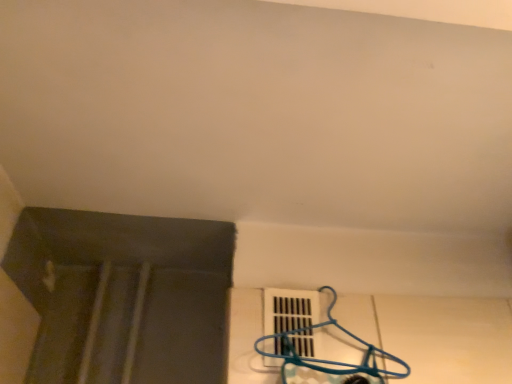
Question: Considering the relative positions of white plastic vent at lower center and blue plastic hanger at lower right in the image provided, is white plastic vent at lower center in front of blue plastic hanger at lower right?

Choices:
 (A) no
 (B) yes

Answer: (A)

Question: Is the depth of white plastic vent at lower center greater than that of blue plastic hanger at lower right?

Choices:
 (A) yes
 (B) no

Answer: (A)

Question: From a real-world perspective, is white plastic vent at lower center positioned under blue plastic hanger at lower right based on gravity?

Choices:
 (A) no
 (B) yes

Answer: (B)

Question: Considering the relative sizes of white plastic vent at lower center and blue plastic hanger at lower right in the image provided, is white plastic vent at lower center thinner than blue plastic hanger at lower right?

Choices:
 (A) yes
 (B) no

Answer: (A)

Question: Is white plastic vent at lower center facing towards blue plastic hanger at lower right?

Choices:
 (A) yes
 (B) no

Answer: (A)

Question: Can you confirm if white plastic vent at lower center is positioned to the left of blue plastic hanger at lower right?

Choices:
 (A) yes
 (B) no

Answer: (A)

Question: Is there a large distance between blue plastic hanger at lower right and white plastic vent at lower center?

Choices:
 (A) no
 (B) yes

Answer: (A)

Question: From the image's perspective, would you say blue plastic hanger at lower right is positioned over white plastic vent at lower center?

Choices:
 (A) no
 (B) yes

Answer: (B)

Question: Is blue plastic hanger at lower right next to white plastic vent at lower center?

Choices:
 (A) no
 (B) yes

Answer: (B)

Question: Is blue plastic hanger at lower right further to the viewer compared to white plastic vent at lower center?

Choices:
 (A) no
 (B) yes

Answer: (A)

Question: Considering the relative sizes of blue plastic hanger at lower right and white plastic vent at lower center in the image provided, is blue plastic hanger at lower right taller than white plastic vent at lower center?

Choices:
 (A) no
 (B) yes

Answer: (B)

Question: Does blue plastic hanger at lower right appear on the right side of white plastic vent at lower center?

Choices:
 (A) yes
 (B) no

Answer: (A)

Question: Is point (309, 375) positioned closer to the camera than point (272, 360)?

Choices:
 (A) farther
 (B) closer

Answer: (B)